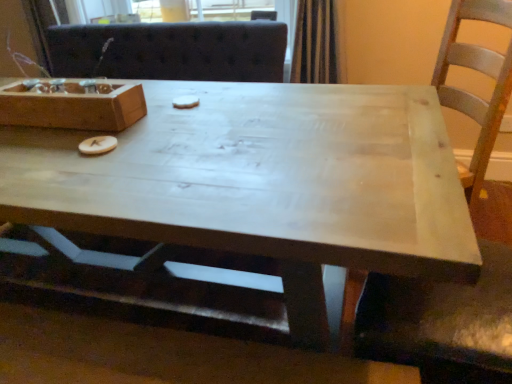
At what (x,y) coordinates should I click in order to perform the action: click on free space in front of white matte cookie at center, which is the 2th food from bottom to top. Please return your answer as a coordinate pair (x, y). This screenshot has height=384, width=512. Looking at the image, I should click on (188, 125).